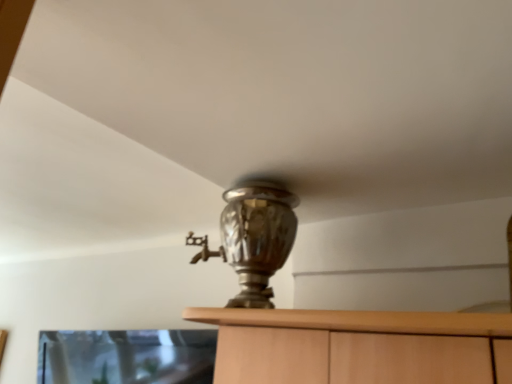
Where is `shiny silver vase at center`? This screenshot has width=512, height=384. shiny silver vase at center is located at coordinates (254, 236).

What do you see at coordinates (254, 236) in the screenshot? This screenshot has width=512, height=384. I see `shiny silver vase at center` at bounding box center [254, 236].

Where is `shiny silver vase at center`? This screenshot has width=512, height=384. shiny silver vase at center is located at coordinates (254, 236).